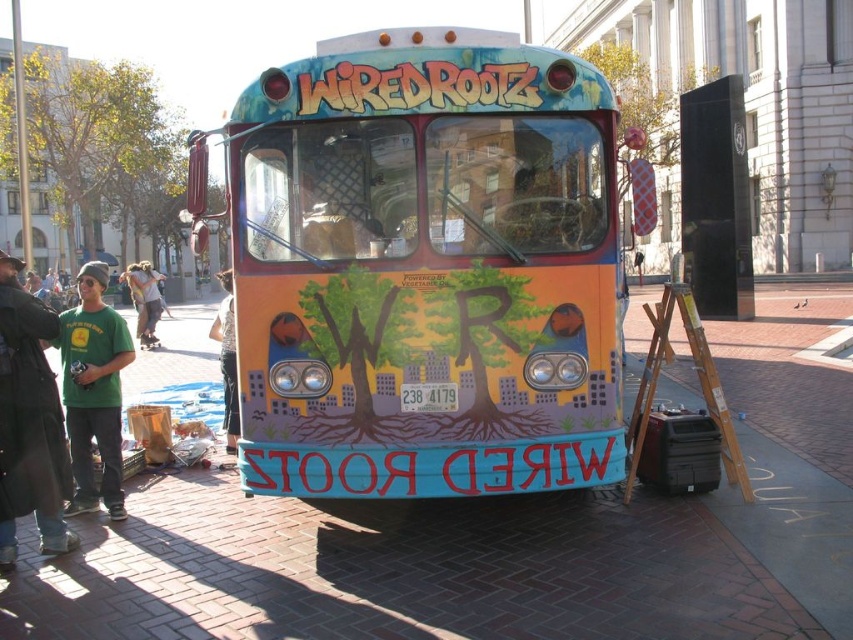
Consider the image. You are a photographer standing on the brick street wanting to take a photo of the matte painted bus at center and the light brown leather jacket at center. Which object should you focus on first to ensure both are in sharp focus?

The matte painted bus at center is closer to the viewer than the light brown leather jacket at center, so you should focus on the matte painted bus at center first to ensure both are in sharp focus.

You are a photographer standing on the brick street. You want to take a picture of the matte painted bus at center and the green cotton shirt at left. Which object should you zoom in on to capture the details of the taller one?

The matte painted bus at center is much taller than the green cotton shirt at left, so you should zoom in on the matte painted bus at center to capture its details.

You are standing on the brick pavement at center and want to move towards the bus. Which direction should you walk to reach the bus?

Since the brick pavement at center is located at point (451,564), you should walk towards the bus which is positioned in front of you according to the scene description. However, without additional spatial information about the bus relative to the brick pavement, it is impossible to determine the exact direction to walk.